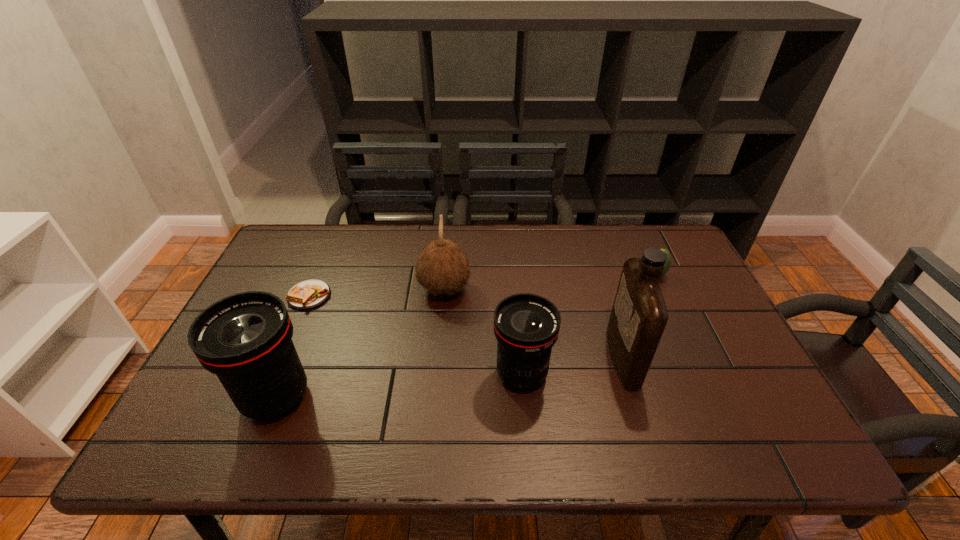
Where is `sandwich that is at the left edge`? The image size is (960, 540). sandwich that is at the left edge is located at coordinates (308, 294).

Find the location of `object situated at the right edge`. object situated at the right edge is located at coordinates (668, 262).

Find the location of a particular element. object at the near left corner is located at coordinates (245, 339).

Where is `object situated at the far right corner`? This screenshot has width=960, height=540. object situated at the far right corner is located at coordinates (668, 262).

In the image, there is a desktop. At what (x,y) coordinates should I click in order to perform the action: click on vacant space at the far edge. Please return your answer as a coordinate pair (x, y). Image resolution: width=960 pixels, height=540 pixels. Looking at the image, I should click on (500, 224).

You are a GUI agent. You are given a task and a screenshot of the screen. Output one action in this format:
    pyautogui.click(x=<x>, y=<y>)
    Task: Click on the free space at the near edge of the desktop
    
    Given the screenshot: What is the action you would take?
    pyautogui.click(x=385, y=386)

This screenshot has width=960, height=540. In the image, there is a desktop. Find the location of `free space at the left edge`. free space at the left edge is located at coordinates 311,270.

You are a GUI agent. You are given a task and a screenshot of the screen. Output one action in this format:
    pyautogui.click(x=<x>, y=<y>)
    Task: Click on the vacant region at the far left corner of the desktop
    This screenshot has height=540, width=960.
    Given the screenshot: What is the action you would take?
    pyautogui.click(x=324, y=250)

Identify the location of vacant region at the far right corner of the desktop. The width and height of the screenshot is (960, 540). (640, 235).

In order to click on free point between the tallest object and the taller telephoto lens in this screenshot , I will do `click(449, 377)`.